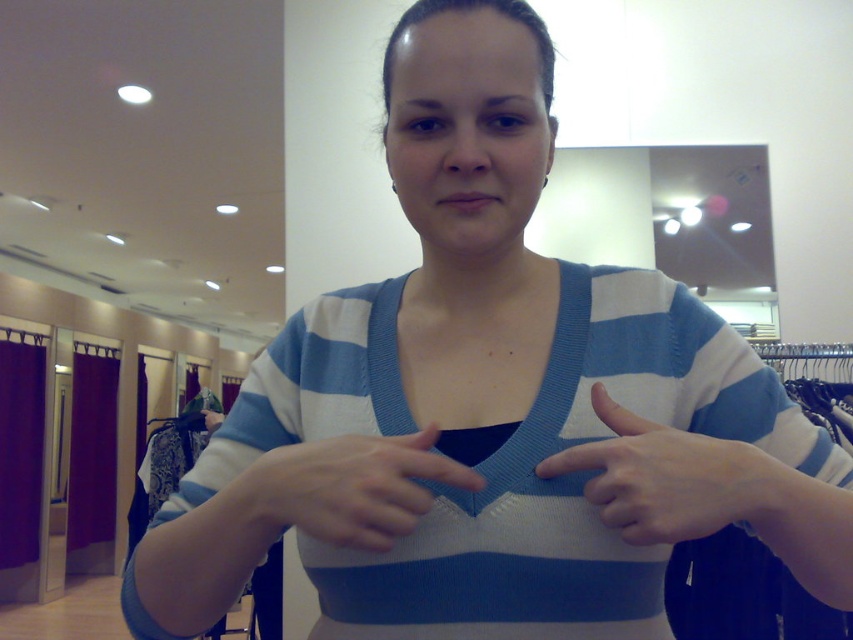
Is white matte fabric at center positioned before white knitted hand at center?

Yes, it is.

I want to click on white matte fabric at center, so click(676, 481).

Identify the location of white matte fabric at center. This screenshot has width=853, height=640. (676, 481).